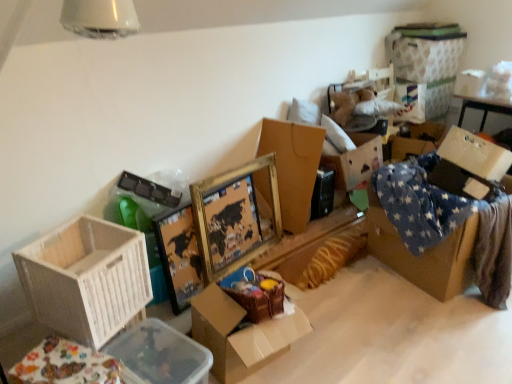
Question: Should I look upward or downward to see clear plastic container at lower left, positioned as the third storage box in right-to-left order?

Choices:
 (A) down
 (B) up

Answer: (A)

Question: Considering the relative positions of gold/gilded picture frame at center and gold cardboard box at center, arranged as the 3th box when viewed from the front, in the image provided, is gold/gilded picture frame at center to the right of gold cardboard box at center, arranged as the 3th box when viewed from the front, from the viewer's perspective?

Choices:
 (A) yes
 (B) no

Answer: (B)

Question: Considering the relative sizes of gold/gilded picture frame at center and gold cardboard box at center, arranged as the 3th box when viewed from the front, in the image provided, is gold/gilded picture frame at center wider than gold cardboard box at center, arranged as the 3th box when viewed from the front,?

Choices:
 (A) no
 (B) yes

Answer: (A)

Question: From a real-world perspective, is gold/gilded picture frame at center physically above gold cardboard box at center, arranged as the 3th box when viewed from the front?

Choices:
 (A) no
 (B) yes

Answer: (B)

Question: From a real-world perspective, is gold/gilded picture frame at center beneath gold cardboard box at center, arranged as the 3th box when viewed from the front?

Choices:
 (A) no
 (B) yes

Answer: (A)

Question: Does gold/gilded picture frame at center have a smaller size compared to gold cardboard box at center, acting as the 1th box starting from the back?

Choices:
 (A) no
 (B) yes

Answer: (A)

Question: Can you confirm if gold/gilded picture frame at center is shorter than gold cardboard box at center, arranged as the 3th box when viewed from the front?

Choices:
 (A) no
 (B) yes

Answer: (A)

Question: Does gold cardboard box at center, arranged as the 3th box when viewed from the front, have a lesser width compared to gold/gilded picture frame at center?

Choices:
 (A) yes
 (B) no

Answer: (B)

Question: Is gold cardboard box at center, acting as the 1th box starting from the back, directly adjacent to gold/gilded picture frame at center?

Choices:
 (A) no
 (B) yes

Answer: (A)

Question: Can you confirm if gold cardboard box at center, arranged as the 3th box when viewed from the front, is smaller than gold/gilded picture frame at center?

Choices:
 (A) no
 (B) yes

Answer: (B)

Question: Could gold/gilded picture frame at center be considered to be inside gold cardboard box at center, acting as the 1th box starting from the back?

Choices:
 (A) no
 (B) yes

Answer: (A)

Question: Is gold cardboard box at center, acting as the 1th box starting from the back, to the left of gold/gilded picture frame at center from the viewer's perspective?

Choices:
 (A) no
 (B) yes

Answer: (A)

Question: Is the depth of gold cardboard box at center, acting as the 1th box starting from the back, less than that of gold/gilded picture frame at center?

Choices:
 (A) no
 (B) yes

Answer: (A)

Question: Is clear plastic container at lower left, positioned as the 1th storage box in bottom-to-top order, positioned beyond the bounds of gold/gilded picture frame at center?

Choices:
 (A) yes
 (B) no

Answer: (A)